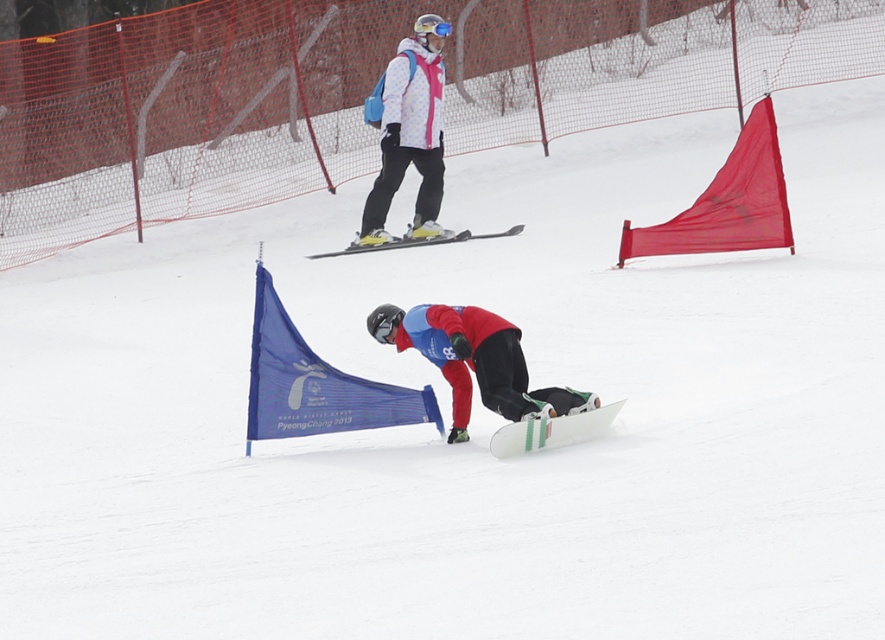
You are a photographer at the event and want to capture both the white matte snowboard at center and the yellow metallic skis at center in a single frame. Considering their sizes, which object should be placed closer to the camera to ensure both fit in the photo?

The white matte snowboard at center occupies less space than the yellow metallic skis at center, so to ensure both fit in the photo, the yellow metallic skis at center should be placed closer to the camera since they are larger and need to be scaled down more to fit within the frame.